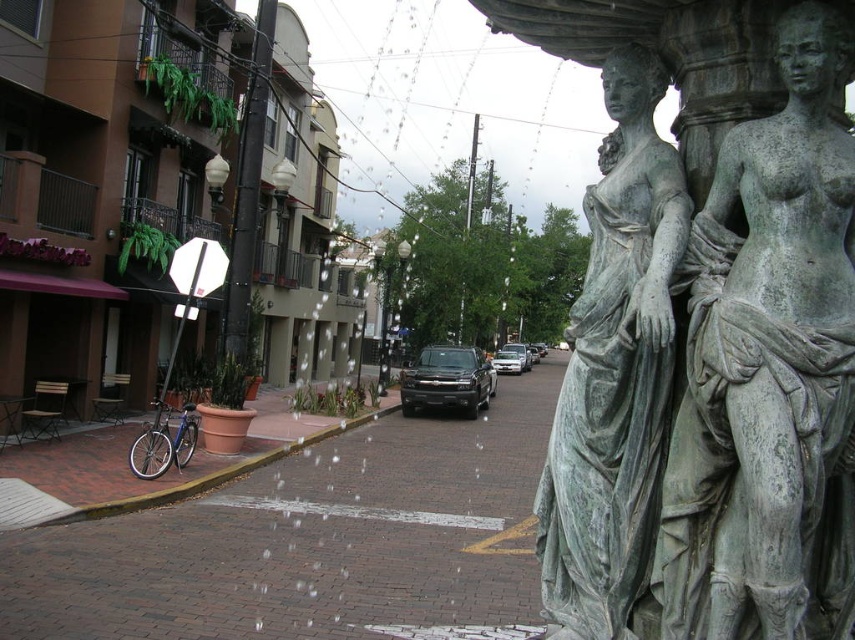
You are standing on the brick street in the middle ground of the urban scene. You see two points marked on the fountain in the foreground. Which point, point (440, 358) or point (514, 358), is closer to you?

Point (440, 358) is closer to you than point (514, 358).

You are a delivery person trying to navigate through the street. You need to move your silver metallic bicycle at lower left past the green patina statue at center. Is this possible given their positions?

The green patina statue at center is located above the silver metallic bicycle at lower left, meaning the statue is elevated and the bicycle is on the ground. Since the bicycle is already positioned below the statue, it can be maneuvered around or past the statue without obstruction.